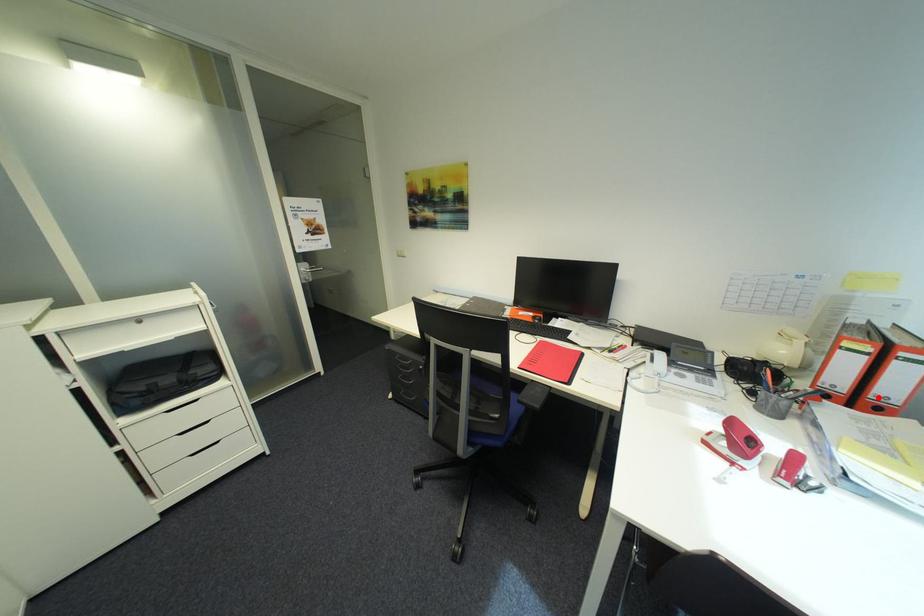
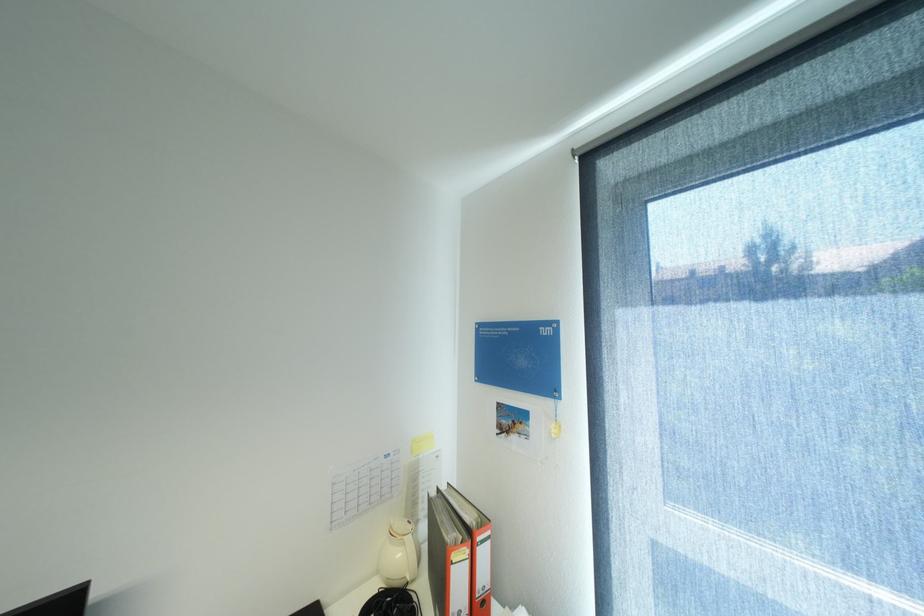
Find the pixel in the second image that matches the highlighted location in the first image.

(484, 597)